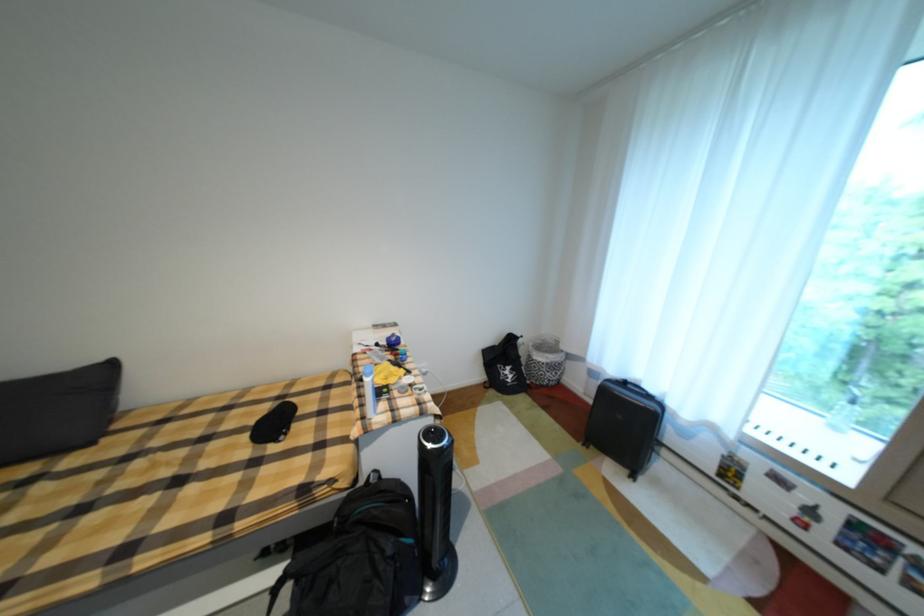
Locate an element on the screen. Image resolution: width=924 pixels, height=616 pixels. black suitcase handle is located at coordinates (634, 387).